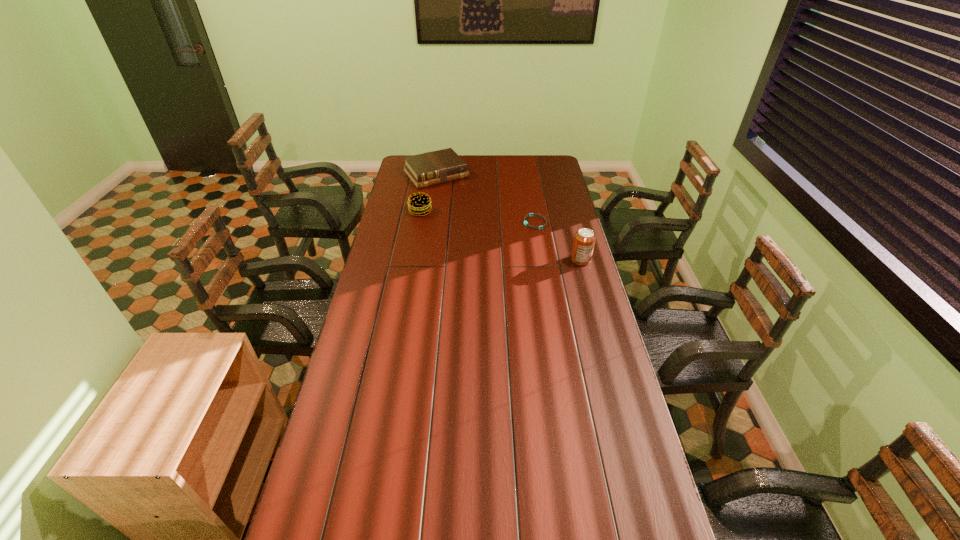
This screenshot has width=960, height=540. What are the coordinates of `vacant space on the desktop that is between the patty and the tallest object and is positioned on the spine side of the farthest object` in the screenshot? It's located at (487, 232).

The height and width of the screenshot is (540, 960). Identify the location of free space on the desktop that is between the patty and the rightmost object and is positioned on the buckle of the third object from left to right. (497, 235).